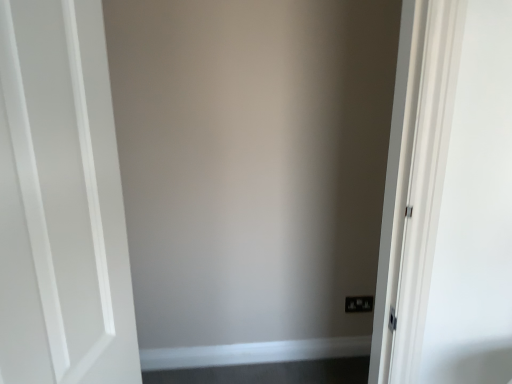
Find the location of a particular element. The width and height of the screenshot is (512, 384). black plastic electric outlet at lower right is located at coordinates (359, 304).

Measure the distance between black plastic electric outlet at lower right and camera.

The distance of black plastic electric outlet at lower right from camera is 7.21 feet.

Describe the element at coordinates (359, 304) in the screenshot. I see `black plastic electric outlet at lower right` at that location.

Where is `black plastic electric outlet at lower right`? This screenshot has width=512, height=384. black plastic electric outlet at lower right is located at coordinates (359, 304).